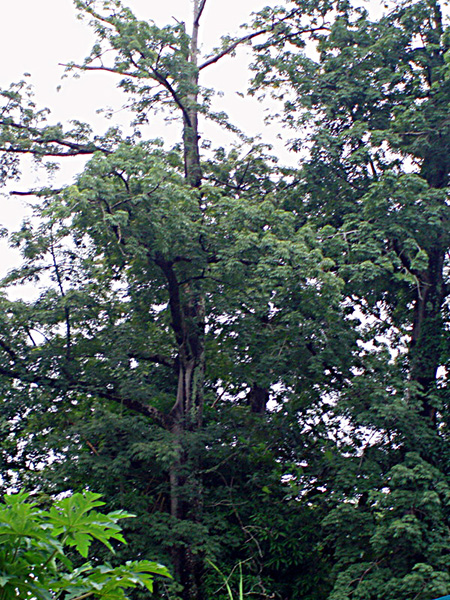
This screenshot has height=600, width=450. What are the coordinates of `rectangular photo longer vertically` in the screenshot? It's located at (335, 429).